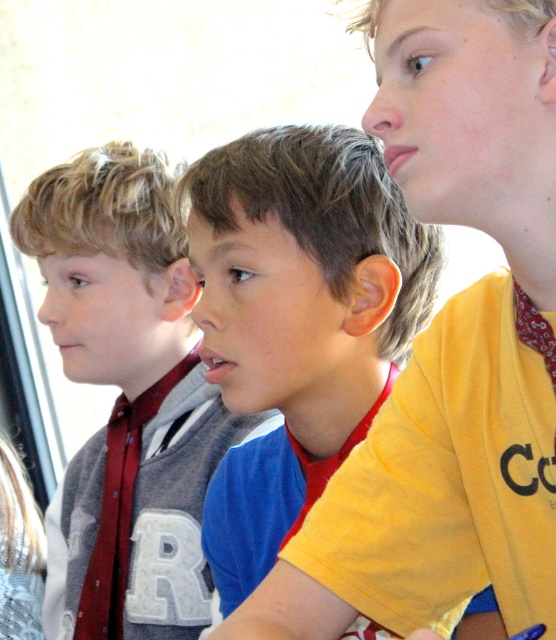
You are a photographer trying to adjust the lighting for a group photo. You notice two items in the scene that might affect the lighting balance. The yellow matte shirt at center and the matte red tie at left. Which of these items is positioned higher up in the frame?

The yellow matte shirt at center is much taller than the matte red tie at left, so it is positioned higher up in the frame.